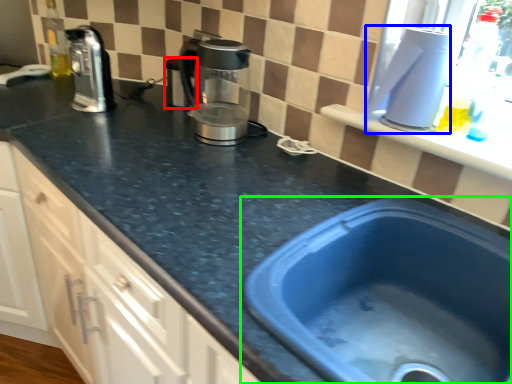
Question: Estimate the real-world distances between objects in this image. Which object is farther from appliance (highlighted by a red box), appliance (highlighted by a blue box) or sink (highlighted by a green box)?

Choices:
 (A) appliance
 (B) sink

Answer: (B)